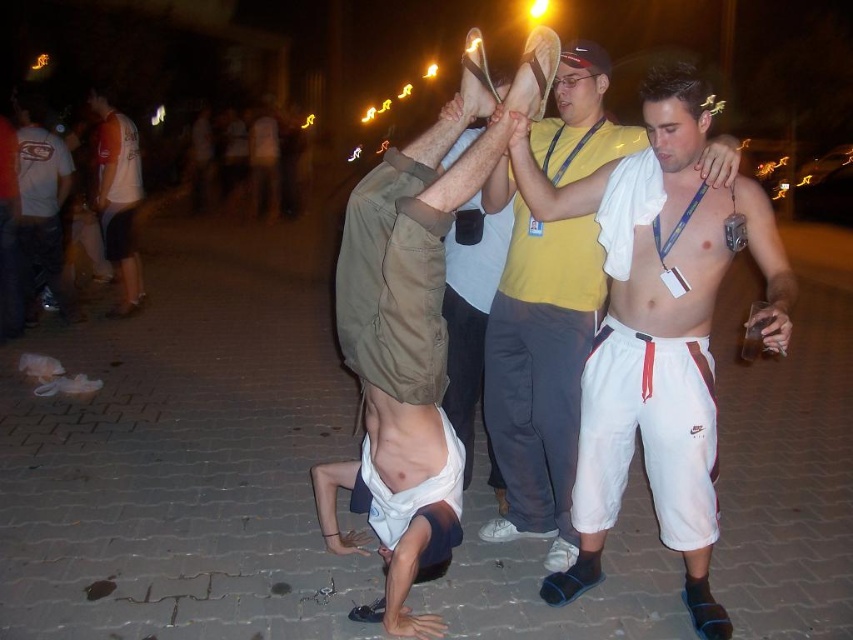
You are a photographer at the event and want to capture both the tan cotton shirt at center and the white cotton shorts at center in a single frame. Given that your camera has a fixed focal length, which object should you focus on to ensure both are in the frame?

The tan cotton shirt at center is larger in size than the white cotton shorts at center. To ensure both are in the frame, focus on the tan cotton shirt at center as it takes up more space, allowing the smaller white cotton shorts at center to fit within the same view.